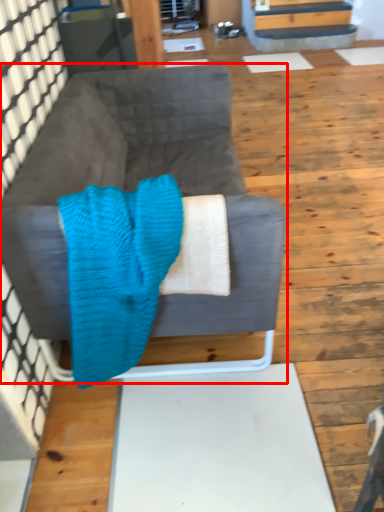
Question: From the image's perspective, considering the relative positions of studio couch (annotated by the red box) and blanket in the image provided, where is studio couch (annotated by the red box) located with respect to the staircase?

Choices:
 (A) above
 (B) below

Answer: (A)